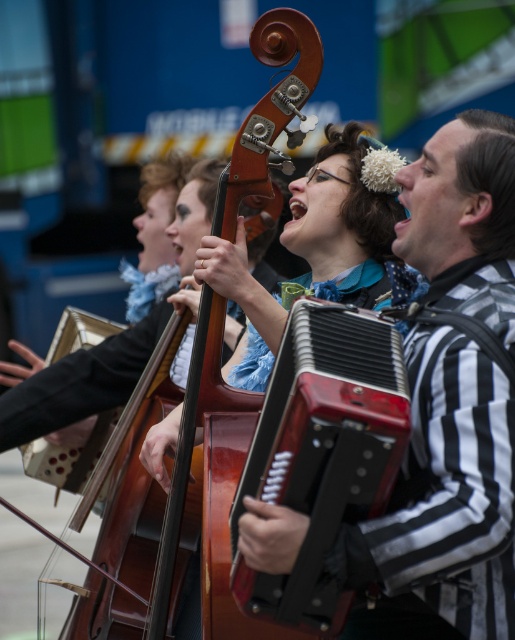
Can you confirm if red leather accordion at center is shorter than matte brown cello at center?

No, red leather accordion at center is not shorter than matte brown cello at center.

From the picture: Can you confirm if red leather accordion at center is smaller than matte brown cello at center?

No.

The width and height of the screenshot is (515, 640). What are the coordinates of `red leather accordion at center` in the screenshot? It's located at (321, 452).

This screenshot has height=640, width=515. Identify the location of red leather accordion at center. (321, 452).

Is matte brown cello at center closer to the viewer compared to wooden violin at center?

No, matte brown cello at center is behind wooden violin at center.

Consider the image. How far apart are matte brown cello at center and wooden violin at center?

matte brown cello at center is 5.68 meters away from wooden violin at center.

Does point (318, 237) come farther from viewer compared to point (195, 394)?

Yes, it is.

Locate an element on the screen. The image size is (515, 640). matte brown cello at center is located at coordinates (345, 220).

Who is positioned more to the left, red leather accordion at center or wooden violin at center?

From the viewer's perspective, wooden violin at center appears more on the left side.

Does point (359, 397) lie in front of point (312, 72)?

Yes, point (359, 397) is closer to viewer.

You are a GUI agent. You are given a task and a screenshot of the screen. Output one action in this format:
    pyautogui.click(x=<x>, y=<y>)
    Task: Click on the red leather accordion at center
    
    Given the screenshot: What is the action you would take?
    pyautogui.click(x=321, y=452)